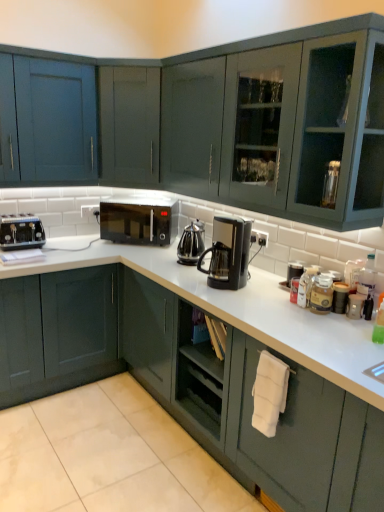
Identify the location of free location in front of black plastic coffee pot at center. The width and height of the screenshot is (384, 512). point(185,270).